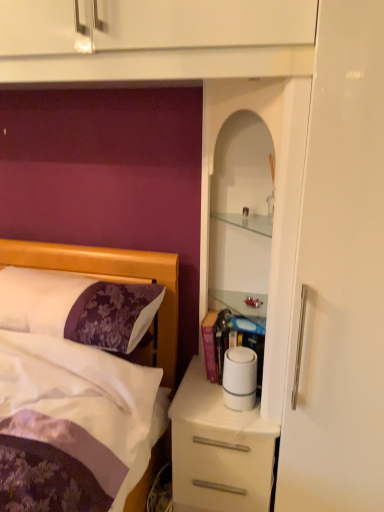
Question: From the image's perspective, is white glossy desk at center on purple satin pillow at left?

Choices:
 (A) yes
 (B) no

Answer: (B)

Question: Can you confirm if white glossy desk at center is taller than purple satin pillow at left?

Choices:
 (A) yes
 (B) no

Answer: (A)

Question: Could you tell me if white glossy desk at center is turned towards purple satin pillow at left?

Choices:
 (A) no
 (B) yes

Answer: (A)

Question: Can you confirm if white glossy desk at center is smaller than purple satin pillow at left?

Choices:
 (A) no
 (B) yes

Answer: (A)

Question: Is white glossy desk at center looking in the opposite direction of purple satin pillow at left?

Choices:
 (A) no
 (B) yes

Answer: (A)

Question: Would you say white glossy desk at center is outside purple satin pillow at left?

Choices:
 (A) no
 (B) yes

Answer: (B)

Question: Is white glossy cabinet at upper right aimed at purple satin pillow at left?

Choices:
 (A) no
 (B) yes

Answer: (A)

Question: Does white glossy cabinet at upper right have a greater width compared to purple satin pillow at left?

Choices:
 (A) no
 (B) yes

Answer: (A)

Question: Considering the relative sizes of white glossy cabinet at upper right and purple satin pillow at left in the image provided, is white glossy cabinet at upper right thinner than purple satin pillow at left?

Choices:
 (A) yes
 (B) no

Answer: (A)

Question: Is white glossy cabinet at upper right beside purple satin pillow at left?

Choices:
 (A) yes
 (B) no

Answer: (B)

Question: From the image's perspective, is white glossy cabinet at upper right below purple satin pillow at left?

Choices:
 (A) no
 (B) yes

Answer: (A)

Question: Is white glossy cabinet at upper right completely or partially outside of purple satin pillow at left?

Choices:
 (A) no
 (B) yes

Answer: (B)

Question: Is white glossy cabinet at upper right closer to camera compared to white matte toilet paper at center?

Choices:
 (A) no
 (B) yes

Answer: (B)